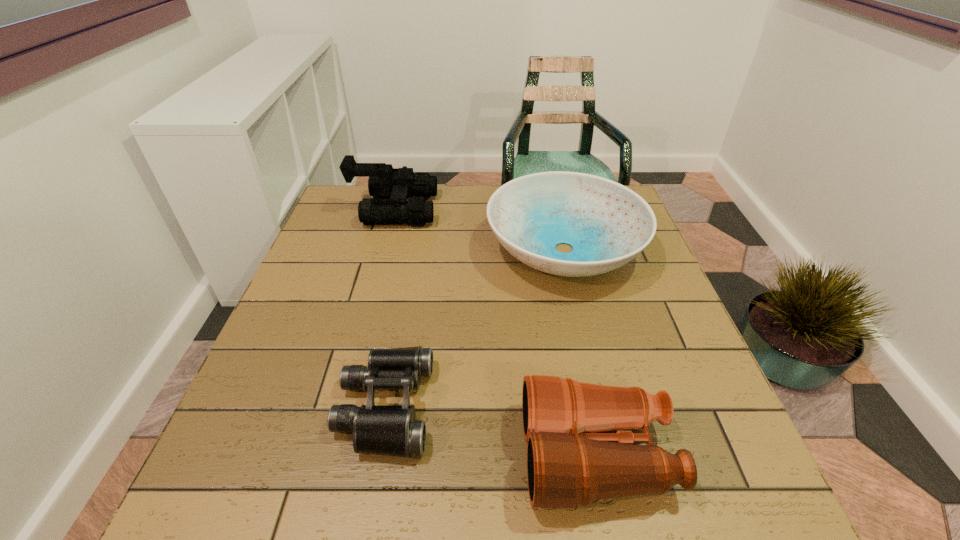
Where is `vacant space that is in between the shortest binoculars and the tallest object`? Image resolution: width=960 pixels, height=540 pixels. vacant space that is in between the shortest binoculars and the tallest object is located at coordinates (390, 308).

Image resolution: width=960 pixels, height=540 pixels. Identify the location of free space between the shortest object and the second tallest binoculars. (491, 430).

Where is `vacant area between the shortest binoculars and the second shortest binoculars`? The height and width of the screenshot is (540, 960). vacant area between the shortest binoculars and the second shortest binoculars is located at coordinates (491, 430).

At what (x,y) coordinates should I click in order to perform the action: click on free space between the shortest binoculars and the tallest binoculars. Please return your answer as a coordinate pair (x, y). Looking at the image, I should click on (390, 308).

In order to click on free space that is in between the shortest object and the dish in this screenshot , I will do `click(474, 328)`.

This screenshot has width=960, height=540. I want to click on object that ranks as the closest to the rightmost binoculars, so click(x=391, y=430).

The image size is (960, 540). In order to click on object that is the second closest to the rightmost binoculars in this screenshot , I will do `click(607, 224)`.

Select which binoculars appears as the second closest to the farthest binoculars. Please provide its 2D coordinates. Your answer should be formatted as a tuple, i.e. [(x, y)], where the tuple contains the x and y coordinates of a point satisfying the conditions above.

[(568, 464)]

Identify which binoculars is located as the nearest to the rightmost binoculars. Please provide its 2D coordinates. Your answer should be formatted as a tuple, i.e. [(x, y)], where the tuple contains the x and y coordinates of a point satisfying the conditions above.

[(391, 430)]

Find the location of a particular element. vacant point that satisfies the following two spatial constraints: 1. on the front side of the dish; 2. on the front-facing side of the shortest object is located at coordinates (601, 407).